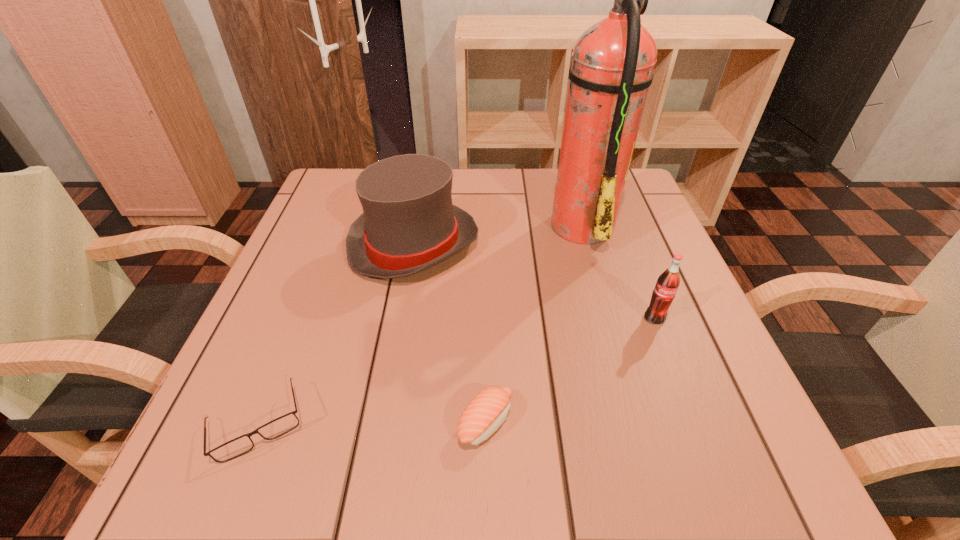
Choose which object is the second nearest neighbor to the shortest object. Please provide its 2D coordinates. Your answer should be formatted as a tuple, i.e. [(x, y)], where the tuple contains the x and y coordinates of a point satisfying the conditions above.

[(488, 410)]